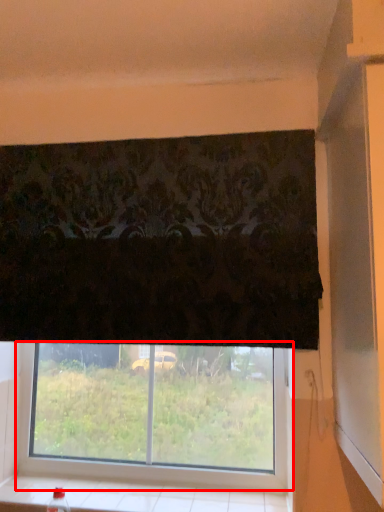
Question: From the image's perspective, where is window (annotated by the red box) located relative to window sill?

Choices:
 (A) below
 (B) above

Answer: (B)